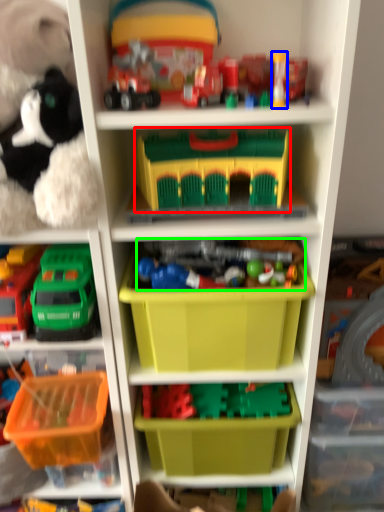
Question: Estimate the real-world distances between objects in this image. Which object is farther from toy (highlighted by a red box), toy (highlighted by a blue box) or toy (highlighted by a green box)?

Choices:
 (A) toy
 (B) toy

Answer: (A)